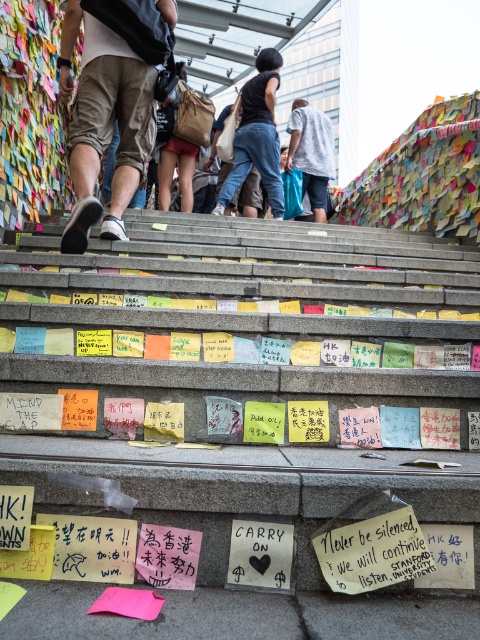
Does black matte tank top at center have a lesser height compared to white cotton shirt at upper center?

Incorrect, black matte tank top at center's height does not fall short of white cotton shirt at upper center's.

Does point (253, 157) lie behind point (288, 144)?

No, (253, 157) is closer to viewer.

In order to click on black matte tank top at center in this screenshot , I will do `click(256, 134)`.

Which of these two, white cotton shirt at upper center or brown canvas bag at center, stands taller?

Standing taller between the two is white cotton shirt at upper center.

Who is lower down, white cotton shirt at upper center or brown canvas bag at center?

brown canvas bag at center

Is point (324, 177) positioned before point (169, 188)?

No, (324, 177) is further to viewer.

Identify the location of white cotton shirt at upper center. The height and width of the screenshot is (640, 480). (312, 152).

Is khaki cotton shorts at lower left below black matte tank top at center?

Yes, khaki cotton shorts at lower left is below black matte tank top at center.

Can you confirm if khaki cotton shorts at lower left is positioned to the left of black matte tank top at center?

Correct, you'll find khaki cotton shorts at lower left to the left of black matte tank top at center.

Is point (87, 195) more distant than point (222, 204)?

No.

Where is `khaki cotton shorts at lower left`? This screenshot has height=640, width=480. khaki cotton shorts at lower left is located at coordinates (104, 122).